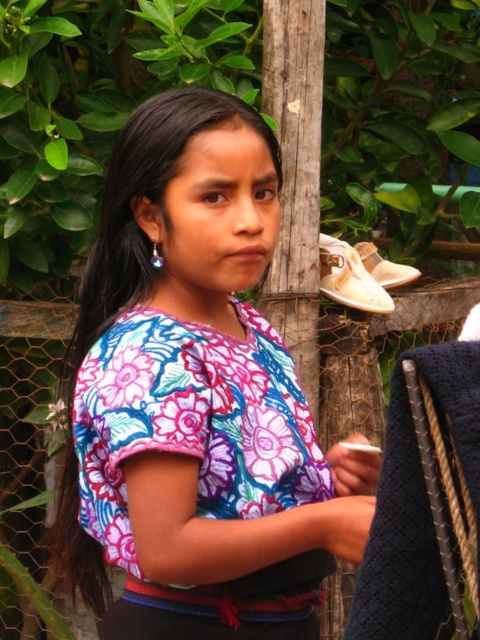
Question: Is floral fabric shirt at center positioned at the back of light brown leather shoe at upper right?

Choices:
 (A) no
 (B) yes

Answer: (A)

Question: From the image, what is the correct spatial relationship of wooden post at center in relation to beige suede shoe at lower right?

Choices:
 (A) right
 (B) left

Answer: (B)

Question: Considering the real-world distances, which object is farthest from the floral fabric dress at center?

Choices:
 (A) beige suede shoe at lower right
 (B) light brown leather shoe at upper right
 (C) wooden post at center
 (D) floral fabric shirt at center

Answer: (A)

Question: Does floral fabric shirt at center appear on the right side of beige suede shoe at lower right?

Choices:
 (A) no
 (B) yes

Answer: (A)

Question: Estimate the real-world distances between objects in this image. Which object is closer to the wooden post at center?

Choices:
 (A) light brown leather shoe at upper right
 (B) floral fabric dress at center
 (C) beige suede shoe at lower right
 (D) floral fabric shirt at center

Answer: (A)

Question: Which point appears farthest from the camera in this image?

Choices:
 (A) click(251, 284)
 (B) click(385, 268)
 (C) click(351, 256)

Answer: (B)